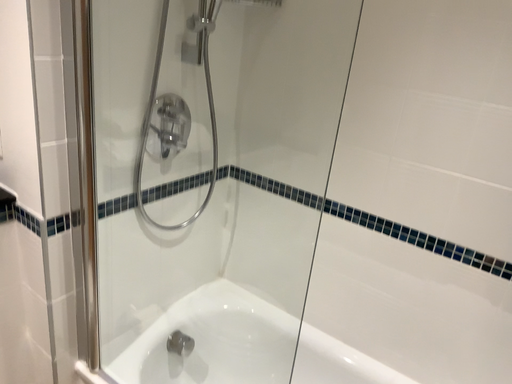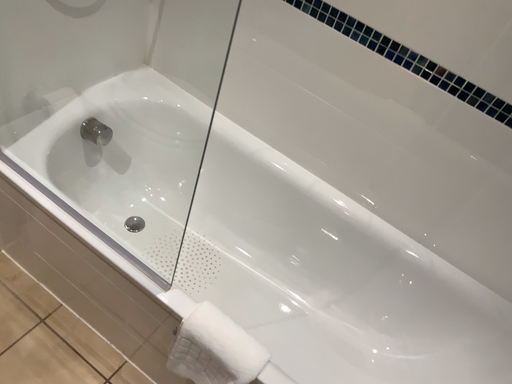
Question: Which way did the camera rotate in the video?

Choices:
 (A) rotated downward
 (B) rotated upward

Answer: (A)